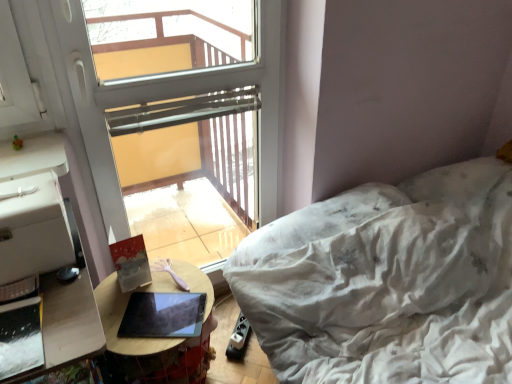
Image resolution: width=512 pixels, height=384 pixels. In order to click on transparent glass window at upper center in this screenshot , I will do `click(170, 98)`.

The height and width of the screenshot is (384, 512). What do you see at coordinates (387, 282) in the screenshot? I see `white textured bed at right` at bounding box center [387, 282].

Image resolution: width=512 pixels, height=384 pixels. I want to click on wooden table at lower left, so click(154, 338).

Find the location of a particular element. Image resolution: width=512 pixels, height=384 pixels. transparent glass window at upper center is located at coordinates (170, 98).

Consider the image. How distant is transparent glass window at upper center from wooden table at lower left?

A distance of 18.83 inches exists between transparent glass window at upper center and wooden table at lower left.

Is transparent glass window at upper center outside of wooden table at lower left?

Yes.

Is wooden table at lower left at the back of transparent glass window at upper center?

No, wooden table at lower left is not at the back of transparent glass window at upper center.

Is wooden table at lower left far from transparent glass window at upper center?

No, wooden table at lower left is not far away from transparent glass window at upper center.

From a real-world perspective, is wooden table at lower left over transparent glass window at upper center?

No, from a real-world perspective, wooden table at lower left is not above transparent glass window at upper center.

Is wooden table at lower left wider than transparent glass window at upper center?

Correct, the width of wooden table at lower left exceeds that of transparent glass window at upper center.

Find the location of a particular element. This screenshot has height=384, width=512. window above the wooden table at lower left (from a real-world perspective) is located at coordinates (170, 98).

Who is taller, matte black tablet at center or white textured bed at right?

Standing taller between the two is white textured bed at right.

From the picture: Between matte black tablet at center and white textured bed at right, which one has smaller width?

Thinner between the two is matte black tablet at center.

Considering the positions of objects matte black tablet at center and white textured bed at right in the image provided, who is more to the left, matte black tablet at center or white textured bed at right?

matte black tablet at center.

From a real-world perspective, which is physically below, matte black tablet at center or wooden table at lower left?

From a 3D spatial view, wooden table at lower left is below.

How many degrees apart are the facing directions of matte black tablet at center and wooden table at lower left?

The angular difference between matte black tablet at center and wooden table at lower left is 30.6 degrees.

From the image's perspective, relative to wooden table at lower left, is matte black tablet at center above or below?

Clearly, from the image's perspective, matte black tablet at center is above wooden table at lower left.

Would you say matte black tablet at center is part of white textured bed at right's contents?

No, matte black tablet at center is not surrounded by white textured bed at right.

The height and width of the screenshot is (384, 512). I want to click on furniture below the matte black tablet at center (from a real-world perspective), so click(x=387, y=282).

Based on the photo, is white textured bed at right next to matte black tablet at center?

No.

From a real-world perspective, is white textured bed at right physically located above or below matte black tablet at center?

From a real-world perspective, white textured bed at right is physically below matte black tablet at center.

Considering the relative positions of matte black tablet at center and transparent glass window at upper center in the image provided, is matte black tablet at center to the left of transparent glass window at upper center from the viewer's perspective?

Yes.

How many degrees apart are the facing directions of matte black tablet at center and transparent glass window at upper center?

There is a 29.5-degree angle between the facing directions of matte black tablet at center and transparent glass window at upper center.

From a real-world perspective, is matte black tablet at center positioned above or below transparent glass window at upper center?

From a real-world perspective, matte black tablet at center is physically below transparent glass window at upper center.

Where is `laptop lying on the left of transparent glass window at upper center`? This screenshot has width=512, height=384. laptop lying on the left of transparent glass window at upper center is located at coordinates tap(163, 315).

Is white textured bed at right directly adjacent to transparent glass window at upper center?

white textured bed at right is not next to transparent glass window at upper center, and they're not touching.

Considering the positions of points (273, 266) and (260, 152), is point (273, 266) closer to camera compared to point (260, 152)?

That is True.

Between white textured bed at right and transparent glass window at upper center, which one has larger size?

With larger size is white textured bed at right.

This screenshot has width=512, height=384. I want to click on table below the transparent glass window at upper center (from a real-world perspective), so click(x=154, y=338).

I want to click on window in front of the wooden table at lower left, so click(x=170, y=98).

Considering their positions, is matte black tablet at center positioned closer to white textured bed at right than transparent glass window at upper center?

matte black tablet at center is positioned closer to the anchor white textured bed at right.

From the image, which object appears to be farther from transparent glass window at upper center, white textured bed at right or matte black tablet at center?

The object further to transparent glass window at upper center is white textured bed at right.

Estimate the real-world distances between objects in this image. Which object is further from wooden table at lower left, transparent glass window at upper center or matte black tablet at center?

The object further to wooden table at lower left is transparent glass window at upper center.

Estimate the real-world distances between objects in this image. Which object is further from white textured bed at right, wooden table at lower left or transparent glass window at upper center?

transparent glass window at upper center.

Which object lies further to the anchor point wooden table at lower left, white textured bed at right or matte black tablet at center?

The object further to wooden table at lower left is white textured bed at right.

Looking at the image, which one is located further to transparent glass window at upper center, wooden table at lower left or matte black tablet at center?

matte black tablet at center lies further to transparent glass window at upper center than the other object.

Looking at the image, which one is located further to white textured bed at right, transparent glass window at upper center or matte black tablet at center?

transparent glass window at upper center.

From the image, which object appears to be nearer to white textured bed at right, transparent glass window at upper center or wooden table at lower left?

wooden table at lower left is positioned closer to the anchor white textured bed at right.

At what (x,y) coordinates should I click in order to perform the action: click on laptop between transparent glass window at upper center and wooden table at lower left in the vertical direction. Please return your answer as a coordinate pair (x, y). Image resolution: width=512 pixels, height=384 pixels. Looking at the image, I should click on (163, 315).

You are a GUI agent. You are given a task and a screenshot of the screen. Output one action in this format:
    pyautogui.click(x=<x>, y=<y>)
    Task: Click on the window between matte black tablet at center and white textured bed at right from left to right
    The width and height of the screenshot is (512, 384).
    Given the screenshot: What is the action you would take?
    pyautogui.click(x=170, y=98)

This screenshot has width=512, height=384. Find the location of `window located between wooden table at lower left and white textured bed at right in the left-right direction`. window located between wooden table at lower left and white textured bed at right in the left-right direction is located at coordinates (170, 98).

You are a GUI agent. You are given a task and a screenshot of the screen. Output one action in this format:
    pyautogui.click(x=<x>, y=<y>)
    Task: Click on the laptop between wooden table at lower left and white textured bed at right from left to right
    The image size is (512, 384).
    Given the screenshot: What is the action you would take?
    pyautogui.click(x=163, y=315)